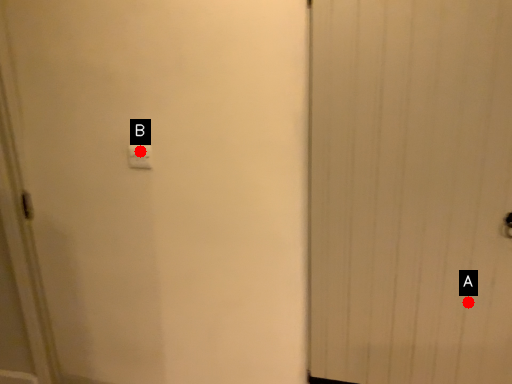
Question: Two points are circled on the image, labeled by A and B beside each circle. Which point is closer to the camera?

Choices:
 (A) A is closer
 (B) B is closer

Answer: (B)